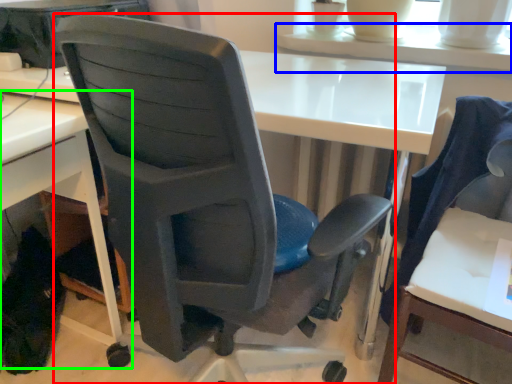
Question: Based on their relative distances, which object is farther from chair (highlighted by a red box)? Choose from table (highlighted by a blue box) and desk (highlighted by a green box).

Choices:
 (A) table
 (B) desk

Answer: (A)